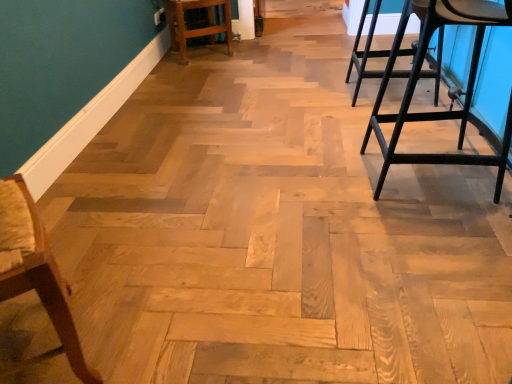
Question: Based on their sizes in the image, would you say light brown wood bar stool at center is bigger or smaller than wooden chair at left?

Choices:
 (A) small
 (B) big

Answer: (B)

Question: Looking at their shapes, would you say light brown wood bar stool at center is wider or thinner than wooden chair at left?

Choices:
 (A) wide
 (B) thin

Answer: (A)

Question: Is light brown wood bar stool at center spatially inside wooden chair at left, or outside of it?

Choices:
 (A) inside
 (B) outside

Answer: (B)

Question: Is point (48, 278) closer or farther from the camera than point (181, 61)?

Choices:
 (A) closer
 (B) farther

Answer: (A)

Question: Considering the positions of wooden chair at left and light brown wood bar stool at center in the image, is wooden chair at left wider or thinner than light brown wood bar stool at center?

Choices:
 (A) thin
 (B) wide

Answer: (A)

Question: In terms of size, does wooden chair at left appear bigger or smaller than light brown wood bar stool at center?

Choices:
 (A) big
 (B) small

Answer: (B)

Question: From a real-world perspective, relative to light brown wood bar stool at center, is wooden chair at left vertically above or below?

Choices:
 (A) above
 (B) below

Answer: (A)